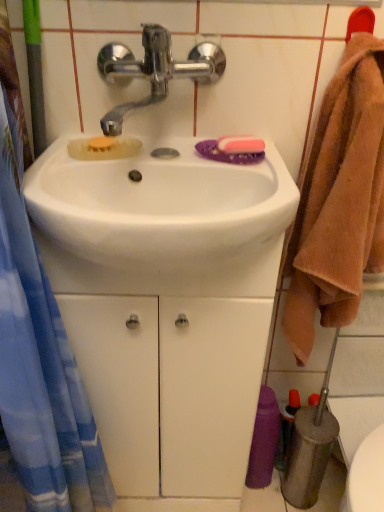
Measure the distance between point (268, 166) and camera.

Point (268, 166) is 26.73 inches from camera.

The image size is (384, 512). What do you see at coordinates (264, 440) in the screenshot?
I see `purple fabric towel at lower right` at bounding box center [264, 440].

In order to face shiny metallic faucet at upper center, should I rotate leftwards or rightwards?

You should look left and rotate roughly 4.137 degrees.

Measure the distance between point (382, 236) and camera.

Point (382, 236) is 32.05 inches away from camera.

The height and width of the screenshot is (512, 384). Identify the location of white glossy cabinet at center. (172, 388).

Locate an element on the screen. white glossy sink at center is located at coordinates (161, 221).

Is white glossy cabinet at center beside brown fluffy towel at right?

No, white glossy cabinet at center is not next to brown fluffy towel at right.

Which of these two, white glossy cabinet at center or brown fluffy towel at right, is smaller?

Smaller between the two is brown fluffy towel at right.

How distant is white glossy cabinet at center from brown fluffy towel at right?

white glossy cabinet at center and brown fluffy towel at right are 10.90 inches apart.

Which of these two, white glossy cabinet at center or brown fluffy towel at right, is thinner?

brown fluffy towel at right.

Could white glossy cabinet at center be considered to be inside white glossy sink at center?

Definitely not — white glossy cabinet at center is not inside white glossy sink at center.

Based on the photo, which object is further away from the camera, white glossy sink at center or white glossy cabinet at center?

white glossy cabinet at center is more distant.

Does point (197, 268) come farther from viewer compared to point (122, 479)?

No, it is not.

Considering the relative positions of white glossy sink at center and white glossy cabinet at center in the image provided, is white glossy sink at center to the right of white glossy cabinet at center from the viewer's perspective?

Yes.

Considering the positions of objects shiny metallic faucet at upper center and white glossy cabinet at center in the image provided, who is more to the left, shiny metallic faucet at upper center or white glossy cabinet at center?

Positioned to the left is white glossy cabinet at center.

Is shiny metallic faucet at upper center looking in the opposite direction of white glossy cabinet at center?

No, shiny metallic faucet at upper center's orientation is not away from white glossy cabinet at center.

Does point (118, 118) lie behind point (152, 360)?

No, (118, 118) is closer to viewer.

Is point (121, 298) farther from camera compared to point (268, 293)?

That is True.

From the image's perspective, who appears lower, white glossy cabinet at center or white glossy sink at center?

white glossy cabinet at center.

Is the position of white glossy cabinet at center more distant than that of white glossy sink at center?

That is True.

Considering the relative positions of shiny metallic faucet at upper center and brown fluffy towel at right in the image provided, is shiny metallic faucet at upper center to the left or to the right of brown fluffy towel at right?

In the image, shiny metallic faucet at upper center appears on the left side of brown fluffy towel at right.

Between shiny metallic faucet at upper center and brown fluffy towel at right, which one has more height?

With more height is brown fluffy towel at right.

From the image's perspective, is shiny metallic faucet at upper center on top of brown fluffy towel at right?

Yes, from the image's perspective, shiny metallic faucet at upper center is above brown fluffy towel at right.

Which of these two, shiny metallic faucet at upper center or brown fluffy towel at right, is smaller?

With smaller size is shiny metallic faucet at upper center.

Which is in front, purple fabric towel at lower right or white glossy cabinet at center?

white glossy cabinet at center is in front.

From a real-world perspective, relative to white glossy cabinet at center, is purple fabric towel at lower right vertically above or below?

In terms of real-world spatial position, purple fabric towel at lower right is below white glossy cabinet at center.

Does purple fabric towel at lower right appear on the right side of white glossy cabinet at center?

Yes, purple fabric towel at lower right is to the right of white glossy cabinet at center.

Based on the photo, from the image's perspective, is purple fabric towel at lower right on white glossy cabinet at center?

No.

Identify the location of drawer directly beneath the brown fluffy towel at right (from a real-world perspective). (172, 388).

Is brown fluffy towel at right next to white glossy cabinet at center and touching it?

brown fluffy towel at right and white glossy cabinet at center are clearly separated.

Is brown fluffy towel at right wider than white glossy cabinet at center?

In fact, brown fluffy towel at right might be narrower than white glossy cabinet at center.

Image resolution: width=384 pixels, height=512 pixels. What are the coordinates of `drawer that appears below the brown fluffy towel at right (from a real-world perspective)` in the screenshot? It's located at (172, 388).

Find the location of a particular element. sink located in front of the white glossy cabinet at center is located at coordinates (161, 221).

When comparing their distances from brown fluffy towel at right, does white glossy sink at center or white glossy cabinet at center seem closer?

white glossy sink at center.

From the image, which object appears to be nearer to brown fluffy towel at right, purple fabric towel at lower right or shiny metallic faucet at upper center?

Based on the image, shiny metallic faucet at upper center appears to be nearer to brown fluffy towel at right.

Based on their spatial positions, is purple fabric towel at lower right or brown fluffy towel at right closer to white glossy cabinet at center?

purple fabric towel at lower right is positioned closer to the anchor white glossy cabinet at center.

Considering their positions, is shiny metallic faucet at upper center positioned closer to brown fluffy towel at right than white glossy cabinet at center?

white glossy cabinet at center is positioned closer to the anchor brown fluffy towel at right.

Estimate the real-world distances between objects in this image. Which object is further from purple fabric towel at lower right, shiny metallic faucet at upper center or white glossy cabinet at center?

shiny metallic faucet at upper center is further to purple fabric towel at lower right.

Looking at the image, which one is located further to shiny metallic faucet at upper center, brown fluffy towel at right or white glossy sink at center?

Based on the image, brown fluffy towel at right appears to be further to shiny metallic faucet at upper center.

Considering their positions, is purple fabric towel at lower right positioned further to white glossy sink at center than brown fluffy towel at right?

Among the two, purple fabric towel at lower right is located further to white glossy sink at center.

Looking at the image, which one is located further to purple fabric towel at lower right, white glossy sink at center or brown fluffy towel at right?

The object further to purple fabric towel at lower right is white glossy sink at center.

Locate an element on the screen. The width and height of the screenshot is (384, 512). sink between shiny metallic faucet at upper center and brown fluffy towel at right in the horizontal direction is located at coordinates (161, 221).

This screenshot has width=384, height=512. I want to click on drawer between white glossy sink at center and purple fabric towel at lower right in the vertical direction, so click(x=172, y=388).

This screenshot has width=384, height=512. What are the coordinates of `sink between shiny metallic faucet at upper center and purple fabric towel at lower right in the up-down direction` in the screenshot? It's located at (161, 221).

Locate an element on the screen. sink between white glossy cabinet at center and brown fluffy towel at right is located at coordinates (161, 221).